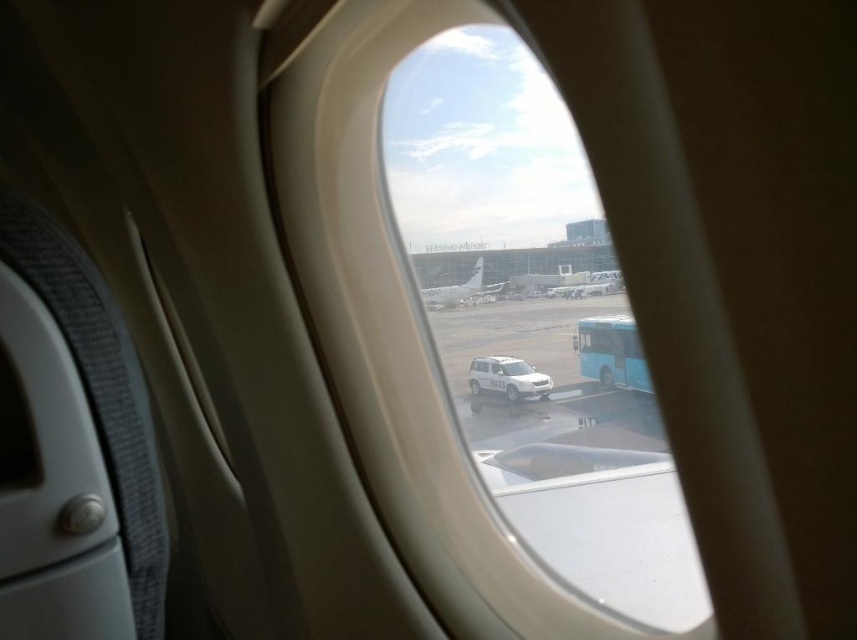
You are a flight attendant on an airplane and you look out the window. You see a white matte airplane at center and a metallic silver airplane at center. Which airplane is closer to you?

The white matte airplane at center is closer to you because the metallic silver airplane at center is behind it.